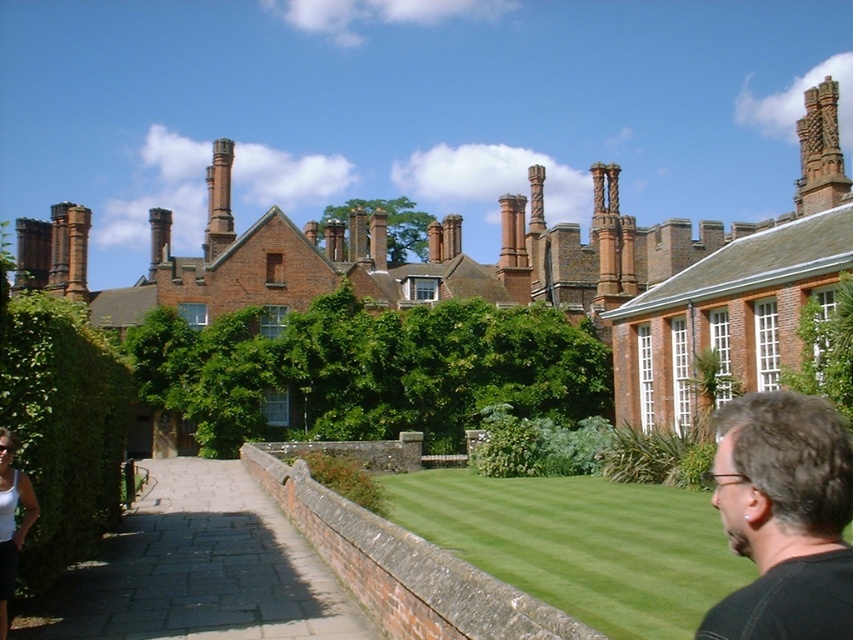
Which is below, green grass at center or dark brown hair at lower right?

green grass at center

In the scene shown: Is the position of green grass at center more distant than that of dark brown hair at lower right?

Yes, it is behind dark brown hair at lower right.

Who is more distant from viewer, (711, 595) or (787, 481)?

Positioned behind is point (711, 595).

Identify the location of green grass at center. (579, 544).

Who is more distant from viewer, (x=815, y=179) or (x=19, y=538)?

Point (x=815, y=179)

Is brown textured chimney at upper right below white fabric at lower left?

Actually, brown textured chimney at upper right is above white fabric at lower left.

Is point (808, 144) behind point (16, 474)?

Yes, point (808, 144) is behind point (16, 474).

Locate an element on the screen. This screenshot has width=853, height=640. brown textured chimney at upper right is located at coordinates (819, 150).

Looking at this image, can you confirm if green grass at center is smaller than smooth brick chimney at upper center?

Yes.

Does green grass at center have a larger size compared to smooth brick chimney at upper center?

No.

Does point (703, 536) come behind point (225, 179)?

No, it is in front of (225, 179).

I want to click on green grass at center, so 579,544.